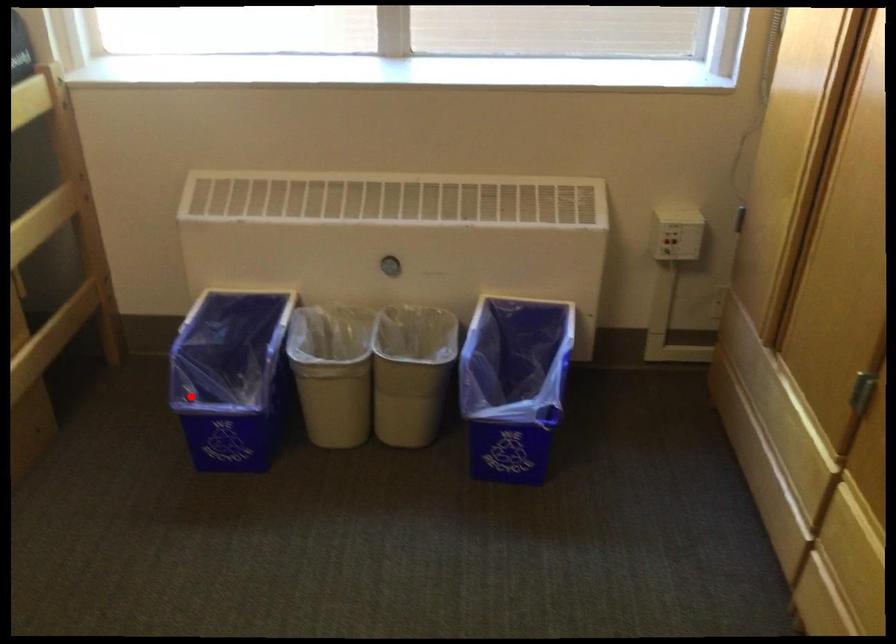
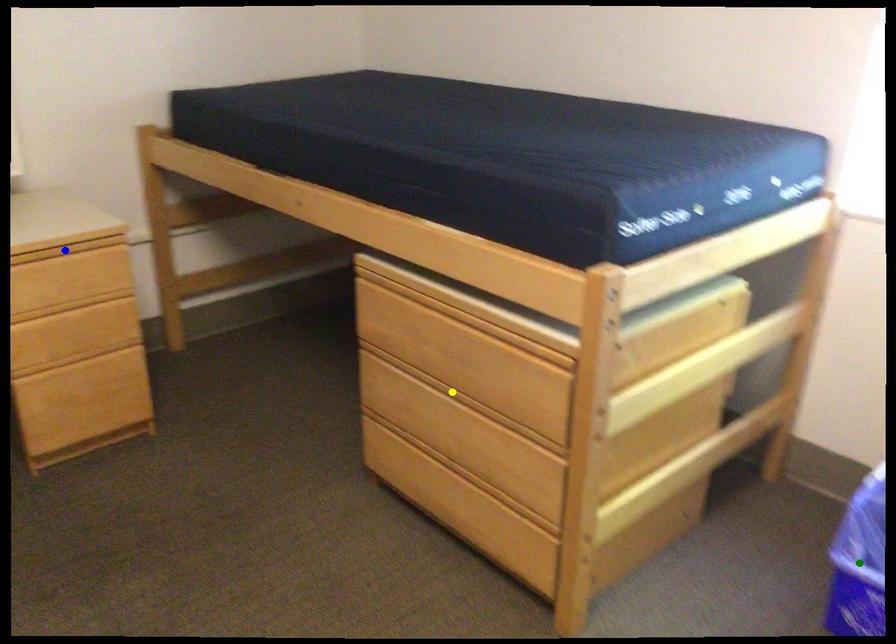
Question: I am providing you with two images of the same scene from different viewpoints. A red point is marked on the first image. You are given multiple points on the second image. Which point in image 2 is actually the same real-world point as the red point in image 1?

Choices:
 (A) yellow point
 (B) green point
 (C) blue point

Answer: (B)